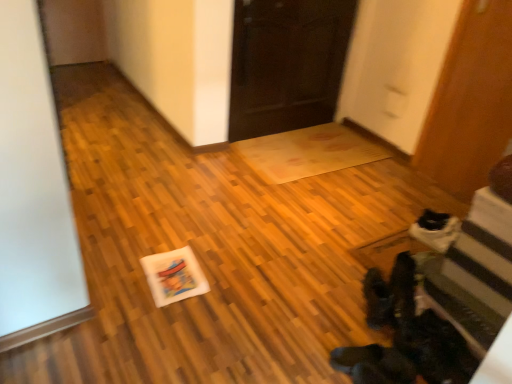
The width and height of the screenshot is (512, 384). In order to click on free space behind black suede boots at lower right in this screenshot , I will do `click(356, 262)`.